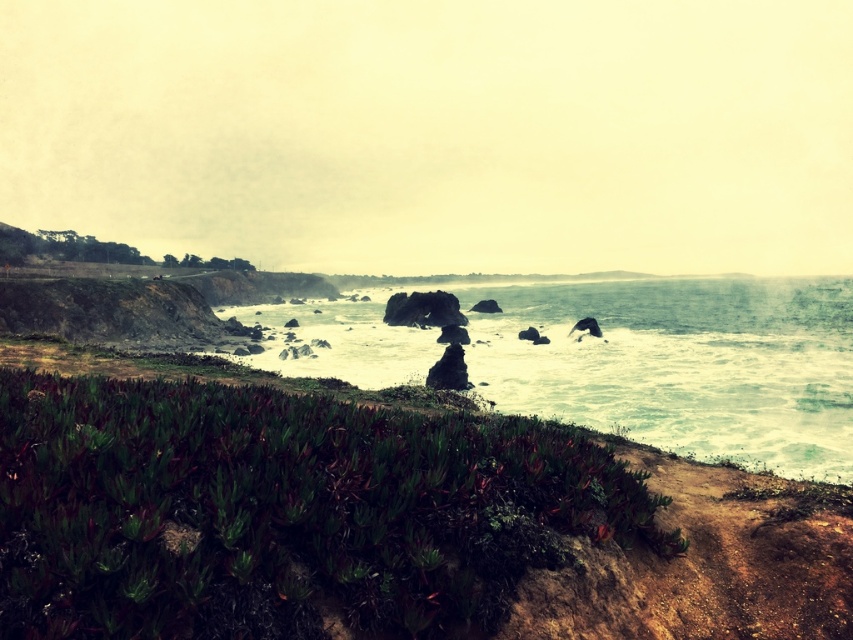
Does green succulent at center have a lesser width compared to white frothy water at center?

Indeed, green succulent at center has a lesser width compared to white frothy water at center.

Does green succulent at center appear on the right side of white frothy water at center?

No, green succulent at center is not to the right of white frothy water at center.

Measure the distance between green succulent at center and camera.

green succulent at center is 4.05 meters from camera.

The image size is (853, 640). I want to click on green succulent at center, so click(282, 509).